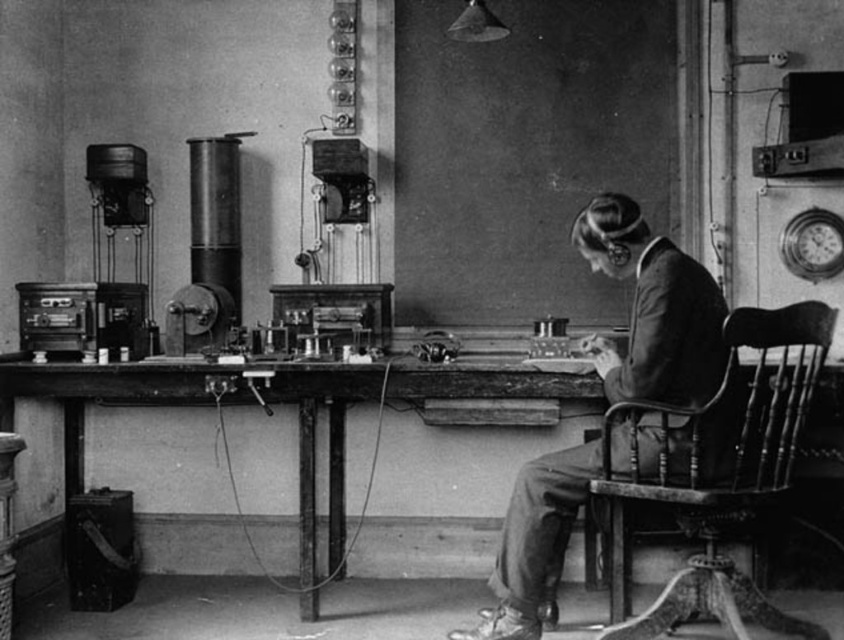
Is point (642, 467) positioned behind point (363, 513)?

No, (642, 467) is closer to viewer.

Which of these two, smooth leather jacket at center or wooden table at center, stands taller?

Standing taller between the two is smooth leather jacket at center.

Between point (671, 358) and point (480, 372), which one is positioned in front?

Point (671, 358)

Locate an element on the screen. The height and width of the screenshot is (640, 844). smooth leather jacket at center is located at coordinates (652, 308).

Where is `smooth leather jacket at center`? The image size is (844, 640). smooth leather jacket at center is located at coordinates (652, 308).

Which is in front, point (572, 228) or point (755, 326)?

Positioned in front is point (755, 326).

Find the location of `smooth leather jacket at center`. smooth leather jacket at center is located at coordinates (652, 308).

Can you confirm if wooden chair at right is positioned above wooden table at center?

Indeed, wooden chair at right is positioned over wooden table at center.

Does point (623, 564) lie behind point (341, 404)?

That is False.

Who is more forward, (x=793, y=426) or (x=507, y=369)?

Point (x=793, y=426)

Where is `wooden chair at right`? This screenshot has height=640, width=844. wooden chair at right is located at coordinates (728, 476).